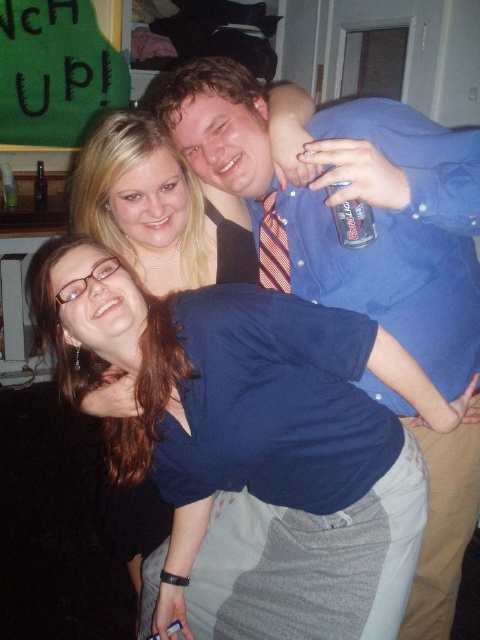
Question: Does blue shirt at center appear under striped fabric tie at center?

Choices:
 (A) yes
 (B) no

Answer: (A)

Question: Estimate the real-world distances between objects in this image. Which object is closer to the blue fabric shirt at lower center?

Choices:
 (A) blue shirt at center
 (B) striped fabric tie at center

Answer: (B)

Question: Which object is the closest to the blue fabric shirt at lower center?

Choices:
 (A) blue shirt at center
 (B) striped fabric tie at center

Answer: (B)

Question: Which point is closer to the camera taking this photo?

Choices:
 (A) pyautogui.click(x=153, y=536)
 (B) pyautogui.click(x=278, y=225)

Answer: (B)

Question: Can you confirm if blue fabric shirt at lower center is positioned to the left of striped fabric tie at center?

Choices:
 (A) yes
 (B) no

Answer: (A)

Question: In this image, where is blue shirt at center located relative to blue fabric shirt at lower center?

Choices:
 (A) below
 (B) above

Answer: (A)